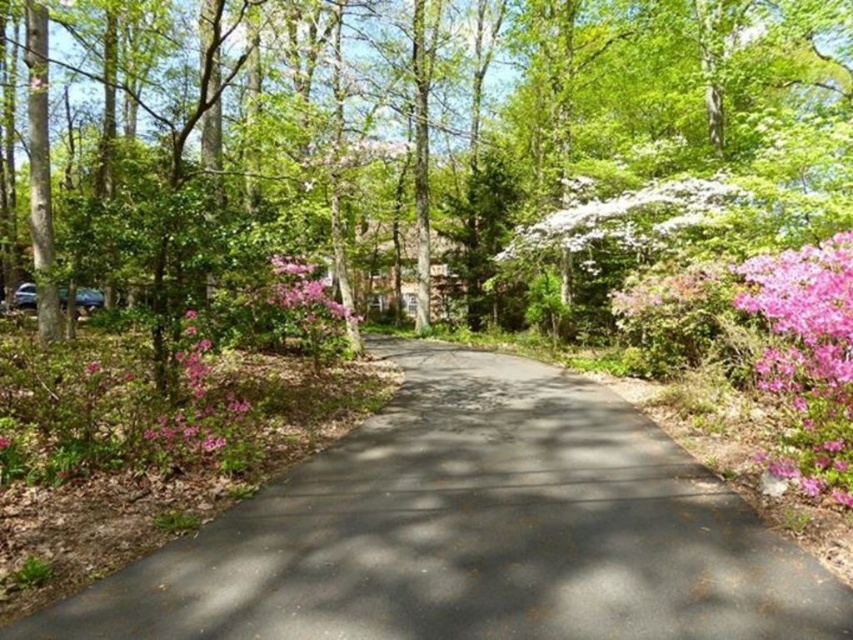
Is point (541, 586) positioned before point (221, 378)?

Yes, it is in front of point (221, 378).

Is black asphalt road at center taller than pink matte flowers at left?

Incorrect, black asphalt road at center's height is not larger of pink matte flowers at left's.

Where is `black asphalt road at center`? The width and height of the screenshot is (853, 640). black asphalt road at center is located at coordinates (474, 531).

Is point (744, 262) farther from camera compared to point (521, 253)?

No, it is in front of (521, 253).

Between point (817, 449) and point (643, 244), which one is positioned behind?

Positioned behind is point (643, 244).

At what (x,y) coordinates should I click in order to perform the action: click on pink matte flower at right. Please return your answer as a coordinate pair (x, y). Looking at the image, I should click on (809, 353).

Is white fluffy flowers at center to the right of pink matte flowers at left from the viewer's perspective?

Correct, you'll find white fluffy flowers at center to the right of pink matte flowers at left.

Does white fluffy flowers at center lie in front of pink matte flowers at left?

No, white fluffy flowers at center is further to the viewer.

Image resolution: width=853 pixels, height=640 pixels. What do you see at coordinates (628, 216) in the screenshot?
I see `white fluffy flowers at center` at bounding box center [628, 216].

Where is `white fluffy flowers at center`? white fluffy flowers at center is located at coordinates (628, 216).